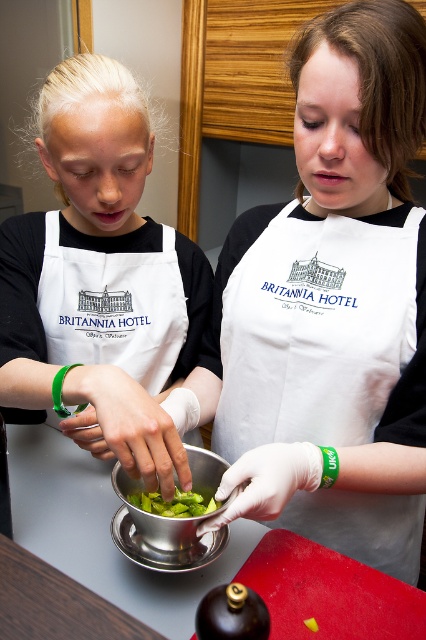
From the picture: You are a guest at the Britannia Hotel and you want to know if the apron provided can cover the bowl completely. Based on the scene, can the white cotton apron at center cover the metallic silver bowl at center?

The white cotton apron at center has a larger width than the metallic silver bowl at center, so it can cover the bowl completely.

You are a guest at the Britannia Hotel and see the two staff members. Which object is closer to the left edge of the image, the matte white apron at left or the metallic silver bowl at center?

The matte white apron at left is positioned on the left side of the metallic silver bowl at center, so it is closer to the left edge of the image.